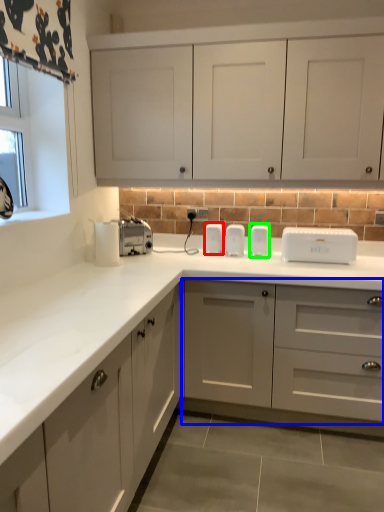
Question: Which object is positioned closest to appliance (highlighted by a red box)? Select from cabinetry (highlighted by a blue box) and appliance (highlighted by a green box).

Choices:
 (A) cabinetry
 (B) appliance

Answer: (B)